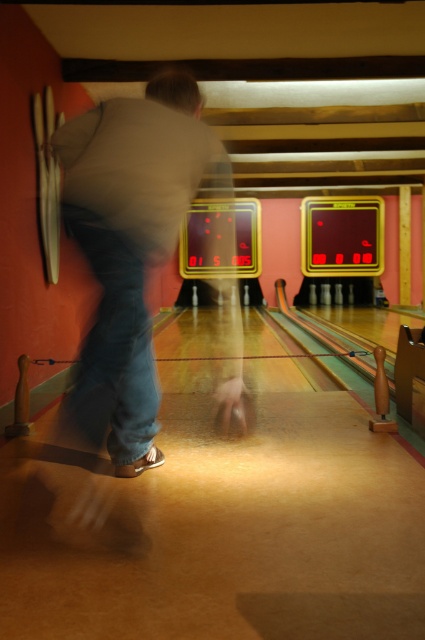
Question: Which point is closer to the camera?

Choices:
 (A) (139, 285)
 (B) (108, 112)

Answer: (A)

Question: Does light brown casual clothing at center have a greater width compared to denim at center?

Choices:
 (A) yes
 (B) no

Answer: (A)

Question: Is light brown casual clothing at center below denim at center?

Choices:
 (A) no
 (B) yes

Answer: (A)

Question: Is light brown casual clothing at center to the left of denim at center from the viewer's perspective?

Choices:
 (A) no
 (B) yes

Answer: (A)